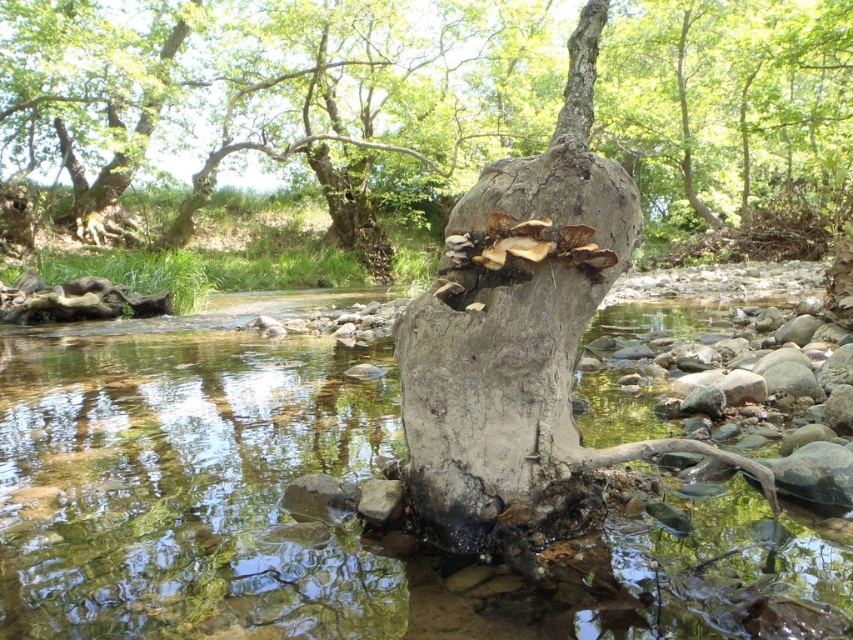
Is smooth gray tree trunk at center further to camera compared to gray rough bark tree trunk at center?

That is True.

Which is below, smooth gray tree trunk at center or gray rough bark tree trunk at center?

gray rough bark tree trunk at center is below.

Which is in front, point (785, 86) or point (497, 291)?

Point (497, 291)

Find the location of a particular element. This screenshot has height=640, width=853. smooth gray tree trunk at center is located at coordinates (280, 96).

Which is below, translucent water at tree center or gray rough bark tree trunk at center?

translucent water at tree center

Is translucent water at tree center below gray rough bark tree trunk at center?

Correct, translucent water at tree center is located below gray rough bark tree trunk at center.

Is point (358, 532) positioned after point (466, 497)?

Yes, it is behind point (466, 497).

The width and height of the screenshot is (853, 640). In order to click on translucent water at tree center in this screenshot , I will do `click(303, 518)`.

Which of these two, translucent water at tree center or smooth gray tree trunk at center, stands shorter?

translucent water at tree center

Locate an element on the screen. This screenshot has height=640, width=853. translucent water at tree center is located at coordinates (303, 518).

Image resolution: width=853 pixels, height=640 pixels. Find the location of `translucent water at tree center`. translucent water at tree center is located at coordinates (303, 518).

Find the location of a particular element. The width and height of the screenshot is (853, 640). translucent water at tree center is located at coordinates (303, 518).